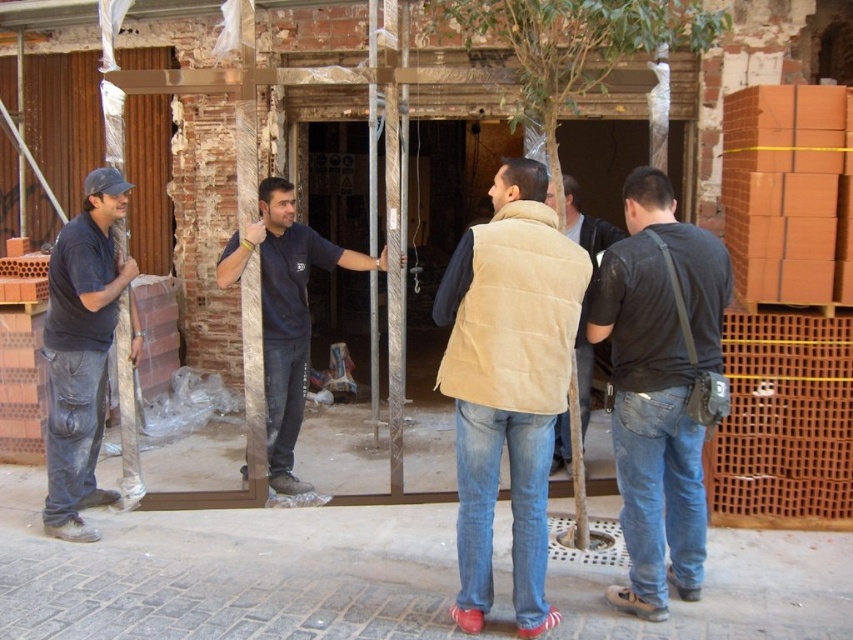
You are a safety inspector at the construction site. You need to ensure that workers are maintaining a safe distance of at least 10 feet apart for safety protocols. Are the workers wearing black denim jeans at right and matte black shirt at left complying with the distance requirement?

The black denim jeans at right and matte black shirt at left are 9.61 feet apart, which is less than the required 10 feet. Therefore, they are not complying with the safety distance requirement.

Please provide the coordinates of the dark blue shirt at center in the image. The coordinates should be in the format of a point like point(285, 312).

The coordinates of the dark blue shirt at center are point(285, 312).

You are a surveyor standing at the center of the construction site. You need to locate the black denim jeans at right. According to the coordinates provided, where should you look to find them?

The black denim jeans at right is located at coordinates point (659, 387). Since you are standing at the center, you should look towards the right side of the site to find them at that specific coordinate position.